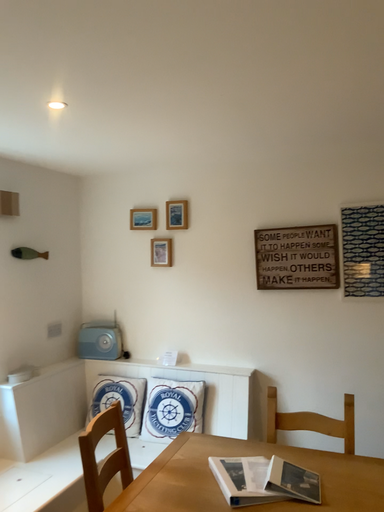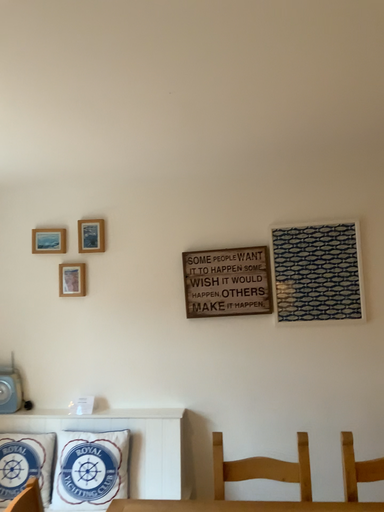
Question: Which way did the camera rotate in the video?

Choices:
 (A) rotated right
 (B) rotated left

Answer: (A)